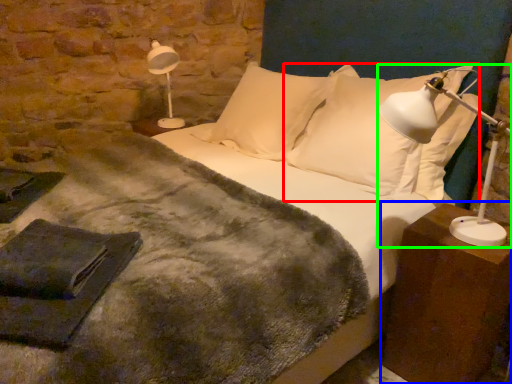
Question: Which object is positioned closest to pillow (highlighted by a red box)? Select from nightstand (highlighted by a blue box) and table lamp (highlighted by a green box).

Choices:
 (A) nightstand
 (B) table lamp

Answer: (B)